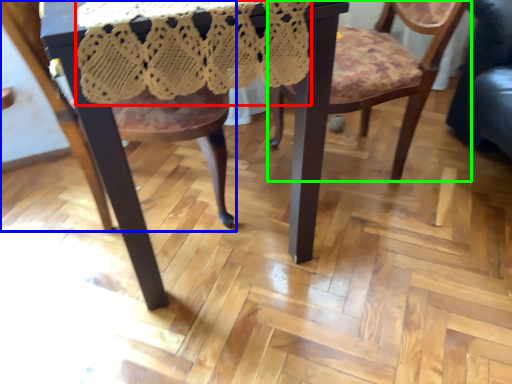
Question: Which object is the farthest from lace dress (highlighted by a red box)? Choose among these: chair (highlighted by a blue box) or chair (highlighted by a green box).

Choices:
 (A) chair
 (B) chair

Answer: (B)